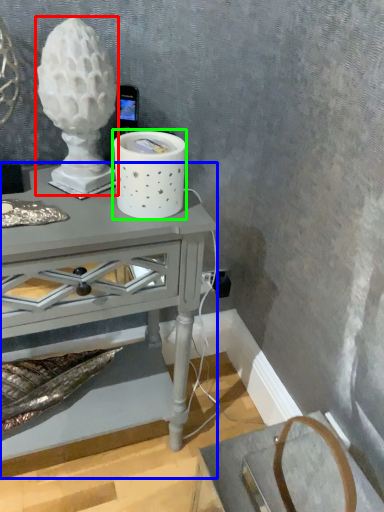
Question: Considering the real-world distances, which object is farthest from candle holder (highlighted by a red box)? table (highlighted by a blue box) or candle holder (highlighted by a green box)?

Choices:
 (A) table
 (B) candle holder

Answer: (A)